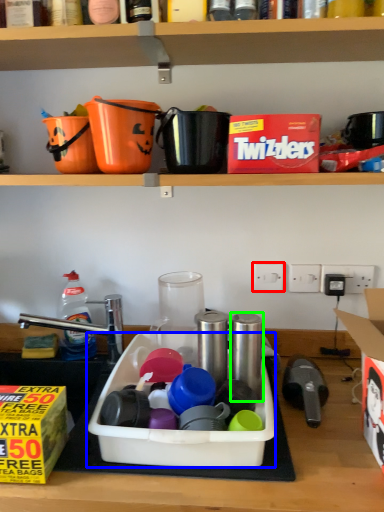
Question: Which object is positioned farthest from electric outlet (highlighted by a red box)? Select from sink (highlighted by a blue box) and appliance (highlighted by a green box).

Choices:
 (A) sink
 (B) appliance

Answer: (A)